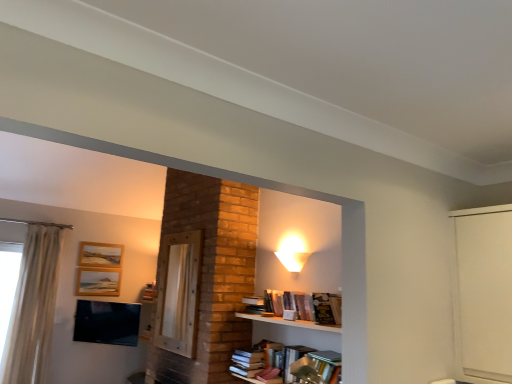
Question: Can you confirm if white frosted glass lampshade at upper center is bigger than wooden picture frame at upper left, which appears as the 1th picture frame when ordered from the bottom?

Choices:
 (A) no
 (B) yes

Answer: (B)

Question: Considering the relative sizes of white frosted glass lampshade at upper center and wooden picture frame at upper left, which appears as the 1th picture frame when ordered from the bottom, in the image provided, is white frosted glass lampshade at upper center thinner than wooden picture frame at upper left, which appears as the 1th picture frame when ordered from the bottom,?

Choices:
 (A) no
 (B) yes

Answer: (A)

Question: Considering the relative sizes of white frosted glass lampshade at upper center and wooden picture frame at upper left, which is the second picture frame in top-to-bottom order, in the image provided, is white frosted glass lampshade at upper center wider than wooden picture frame at upper left, which is the second picture frame in top-to-bottom order,?

Choices:
 (A) yes
 (B) no

Answer: (A)

Question: Does white frosted glass lampshade at upper center have a lesser height compared to wooden picture frame at upper left, which appears as the 1th picture frame when ordered from the bottom?

Choices:
 (A) yes
 (B) no

Answer: (A)

Question: Is white frosted glass lampshade at upper center at the right side of wooden picture frame at upper left, which appears as the 1th picture frame when ordered from the bottom?

Choices:
 (A) no
 (B) yes

Answer: (B)

Question: From the image's perspective, is white frosted glass lampshade at upper center above wooden picture frame at upper left, which is the second picture frame in top-to-bottom order?

Choices:
 (A) yes
 (B) no

Answer: (A)

Question: Is wooden picture frame at upper left, acting as the 2th picture frame starting from the bottom, shorter than matte black tv at lower left?

Choices:
 (A) yes
 (B) no

Answer: (A)

Question: Considering the relative positions of wooden picture frame at upper left, marked as the 1th picture frame in a top-to-bottom arrangement, and matte black tv at lower left in the image provided, is wooden picture frame at upper left, marked as the 1th picture frame in a top-to-bottom arrangement, to the right of matte black tv at lower left from the viewer's perspective?

Choices:
 (A) no
 (B) yes

Answer: (A)

Question: Is wooden picture frame at upper left, marked as the 1th picture frame in a top-to-bottom arrangement, directly adjacent to matte black tv at lower left?

Choices:
 (A) no
 (B) yes

Answer: (A)

Question: Is matte black tv at lower left inside wooden picture frame at upper left, marked as the 1th picture frame in a top-to-bottom arrangement?

Choices:
 (A) yes
 (B) no

Answer: (B)

Question: From a real-world perspective, is wooden picture frame at upper left, marked as the 1th picture frame in a top-to-bottom arrangement, positioned over matte black tv at lower left based on gravity?

Choices:
 (A) no
 (B) yes

Answer: (B)

Question: Does wooden picture frame at upper left, marked as the 1th picture frame in a top-to-bottom arrangement, have a greater width compared to matte black tv at lower left?

Choices:
 (A) no
 (B) yes

Answer: (A)

Question: Is white sheer curtain at left to the right of wooden picture frame at upper left, which is the second picture frame in top-to-bottom order, from the viewer's perspective?

Choices:
 (A) yes
 (B) no

Answer: (B)